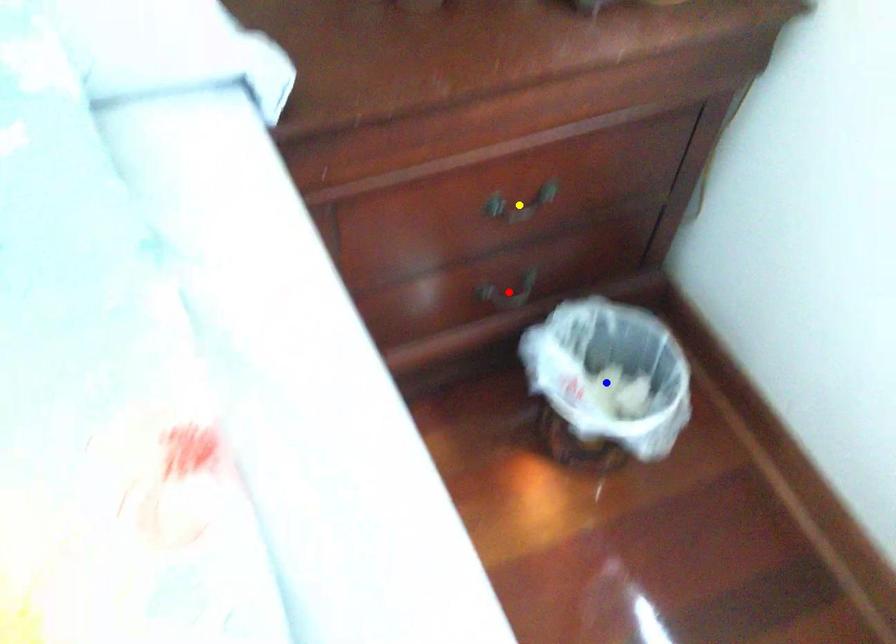
Order these from nearest to farthest:
1. yellow point
2. blue point
3. red point

1. yellow point
2. blue point
3. red point